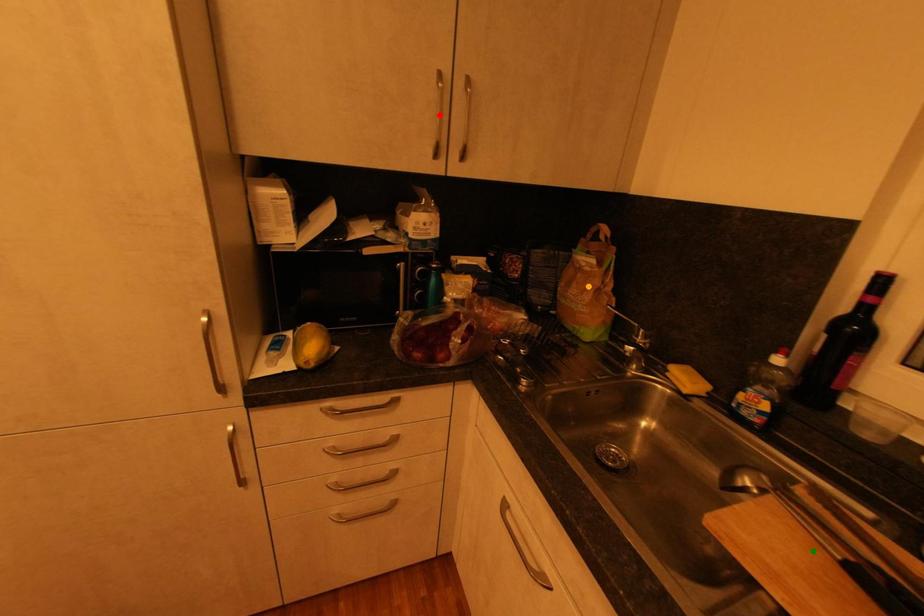
Order these from farthest to nearest:
orange point
red point
green point

orange point, red point, green point